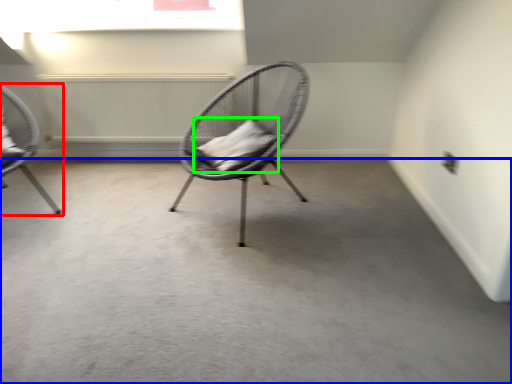
Question: Based on their relative distances, which object is farther from chair (highlighted by a red box)? Choose from concrete (highlighted by a blue box) and pillow (highlighted by a green box).

Choices:
 (A) concrete
 (B) pillow

Answer: (A)